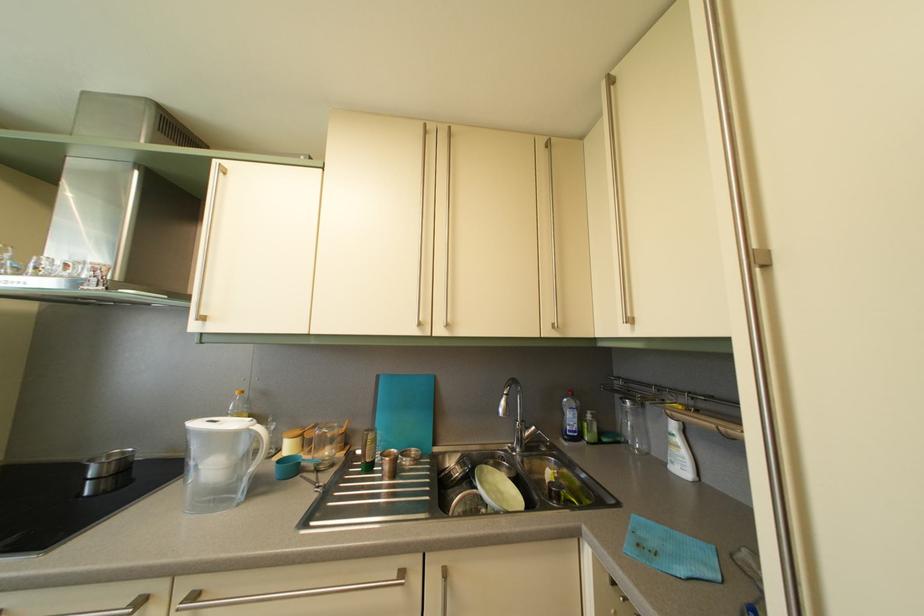
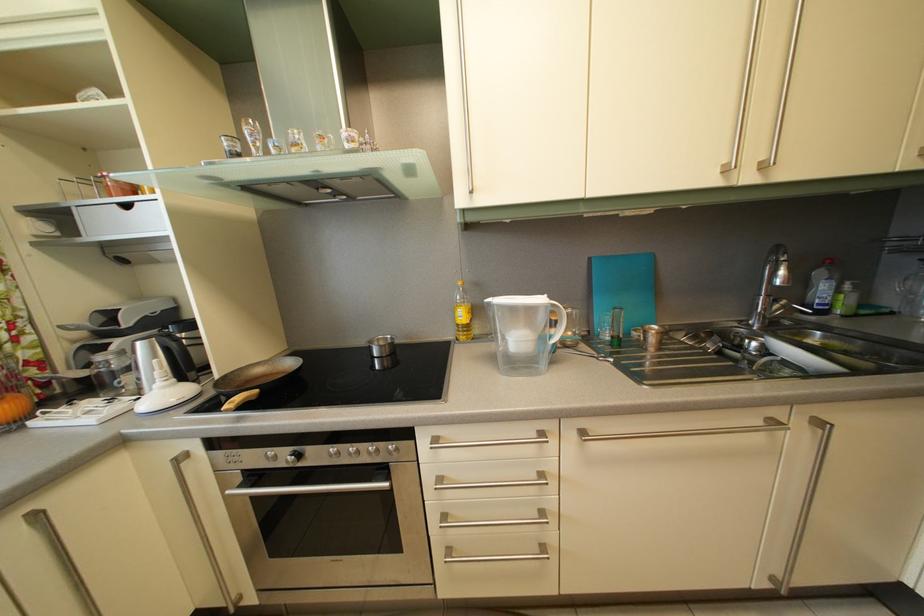
Question: The images are taken continuously from a first-person perspective. In which direction are you moving?

Choices:
 (A) Left
 (B) Right
 (C) Forward
 (D) Backward

Answer: (A)